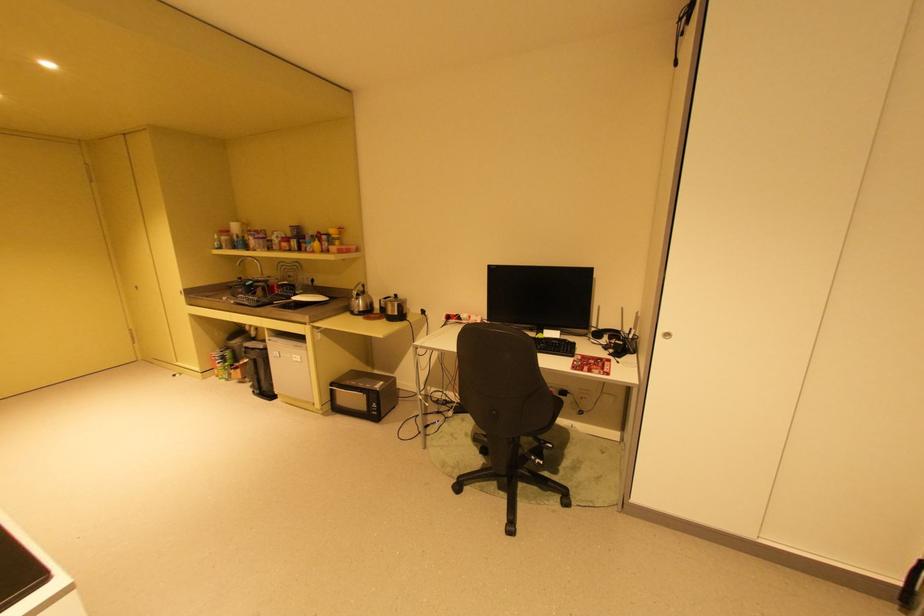
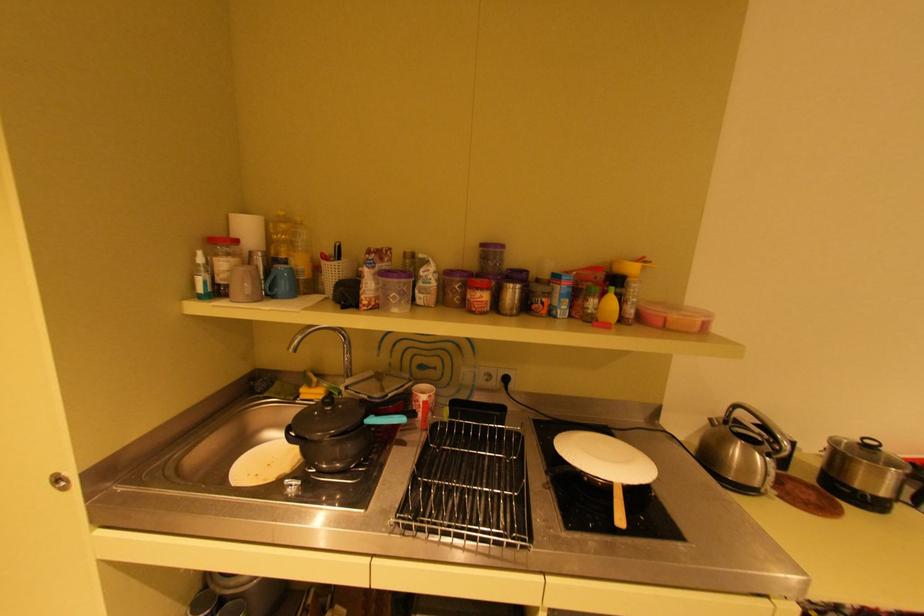
Locate, in the second image, the point that corresponds to the point at 322,249 in the first image.

(611, 318)